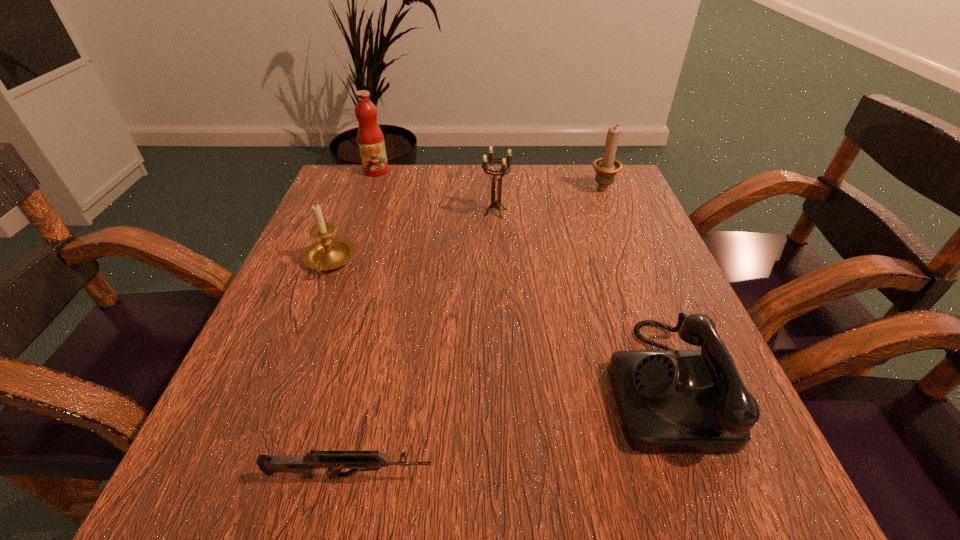
Locate an element on the screen. The width and height of the screenshot is (960, 540). gun located at the near edge is located at coordinates (356, 460).

Find the location of a particular element. fruit juice located at the left edge is located at coordinates (370, 138).

Where is `candle holder positioned at the left edge`? This screenshot has width=960, height=540. candle holder positioned at the left edge is located at coordinates (329, 253).

Image resolution: width=960 pixels, height=540 pixels. Identify the location of gun that is at the left edge. (356, 460).

Identify the location of candle_holder located at the right edge. (606, 168).

Locate an element on the screen. The height and width of the screenshot is (540, 960). telephone that is at the right edge is located at coordinates (669, 401).

Where is `object located in the far left corner section of the desktop`? The width and height of the screenshot is (960, 540). object located in the far left corner section of the desktop is located at coordinates (370, 138).

Image resolution: width=960 pixels, height=540 pixels. I want to click on object that is at the near left corner, so click(x=356, y=460).

Locate an element on the screen. This screenshot has width=960, height=540. object that is at the far right corner is located at coordinates tap(606, 168).

Where is `object located at the near right corner`? Image resolution: width=960 pixels, height=540 pixels. object located at the near right corner is located at coordinates (669, 401).